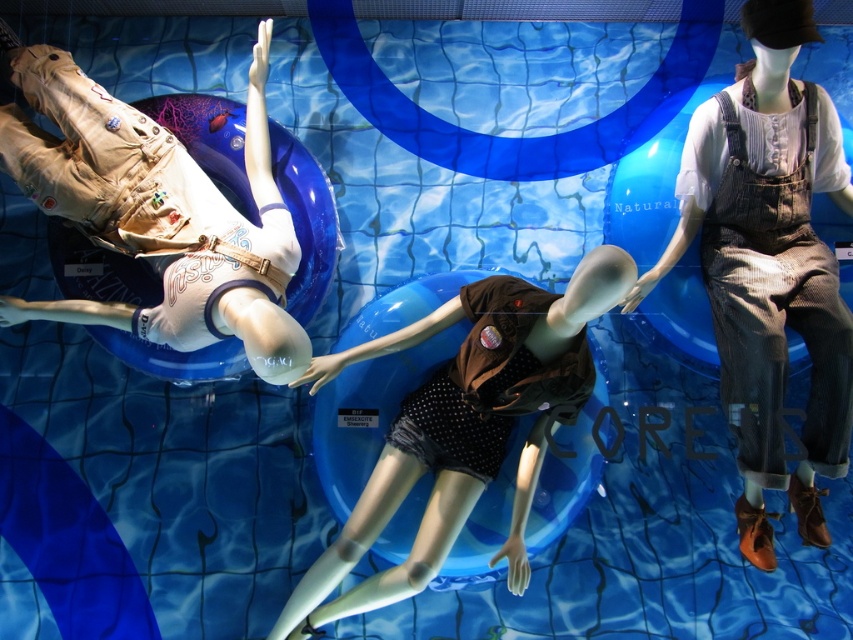
What do you see at coordinates (769, 266) in the screenshot? I see `denim overalls at right` at bounding box center [769, 266].

Does denim overalls at right appear under brown dotted fabric at center?

Incorrect, denim overalls at right is not positioned below brown dotted fabric at center.

Is point (772, 548) farther from camera compared to point (318, 592)?

Yes, it is behind point (318, 592).

At what (x,y) coordinates should I click in order to perform the action: click on denim overalls at right. Please return your answer as a coordinate pair (x, y). Image resolution: width=853 pixels, height=640 pixels. Looking at the image, I should click on (769, 266).

I want to click on denim overalls at right, so click(769, 266).

Between denim overalls at right and brown corduroy overalls at right, which one has less height?

Standing shorter between the two is brown corduroy overalls at right.

Who is more forward, (833, 470) or (732, 221)?

Point (833, 470) is more forward.

Locate an element on the screen. The height and width of the screenshot is (640, 853). denim overalls at right is located at coordinates 769,266.

Between matte khaki pants at left and brown dotted fabric at center, which one is positioned lower?

brown dotted fabric at center

Is matte khaki pants at left taller than brown dotted fabric at center?

In fact, matte khaki pants at left may be shorter than brown dotted fabric at center.

Who is more distant from viewer, (41, 92) or (399, 333)?

Point (399, 333)

Locate an element on the screen. The height and width of the screenshot is (640, 853). matte khaki pants at left is located at coordinates (157, 214).